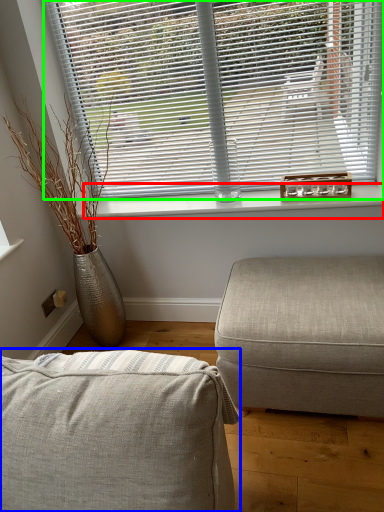
Question: Considering the real-world distances, which object is closest to window sill (highlighted by a red box)? studio couch (highlighted by a blue box) or window blind (highlighted by a green box).

Choices:
 (A) studio couch
 (B) window blind

Answer: (B)